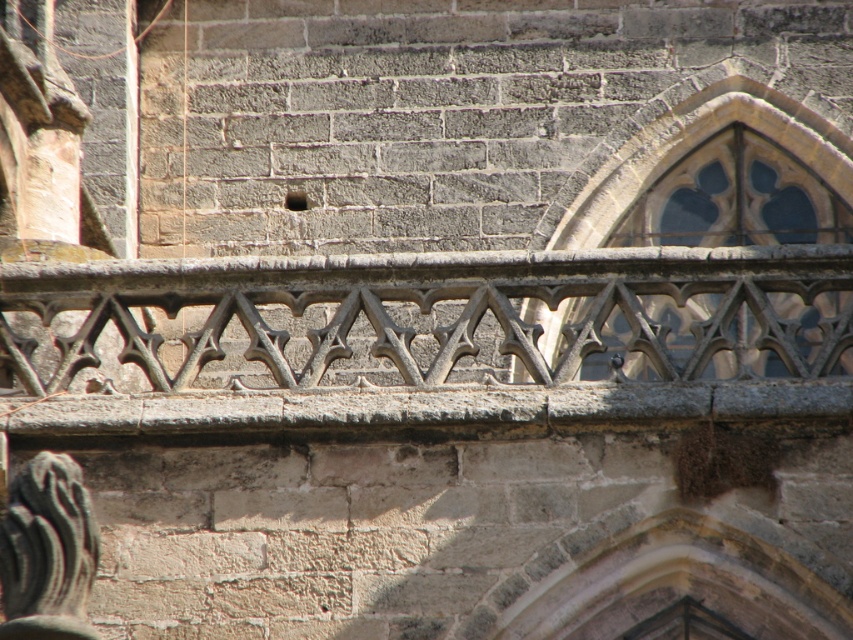
You are standing in front of the stone wall and want to locate the gray stone railing at center. Where exactly is it positioned?

The gray stone railing at center is positioned at point (438, 314).

You are standing in front of the stone wall and notice two points marked on it. The first point is at coordinates point (128, 269) and the second is at point (711, 168). Which point is nearer to your current position?

Point (128, 269) is closer to the camera than point (711, 168), so the first point is nearer to your current position.

You are an architect examining the stone wall. You need to determine the relative heights of the gray stone railing at center and the stone stained glass window at upper right. Based on the scene, which object is taller?

The stone stained glass window at upper right is taller than the gray stone railing at center.